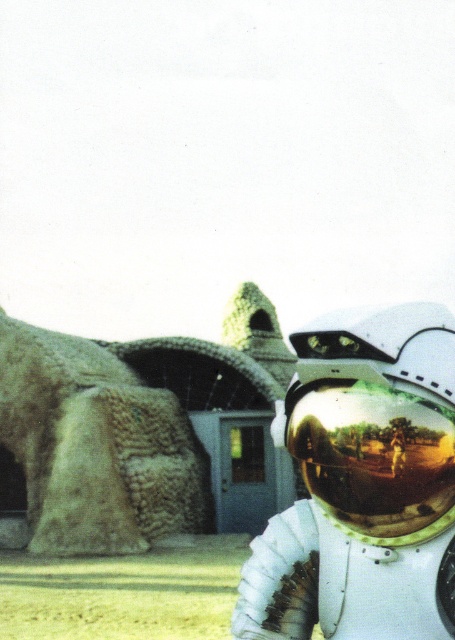
Measure the distance between shiny gold helmet at center and gold reflective helmet at center.

shiny gold helmet at center and gold reflective helmet at center are 3.78 inches apart from each other.

Is shiny gold helmet at center shorter than gold reflective helmet at center?

No, shiny gold helmet at center is not shorter than gold reflective helmet at center.

Describe the element at coordinates (362, 483) in the screenshot. The height and width of the screenshot is (640, 455). I see `shiny gold helmet at center` at that location.

In order to click on shiny gold helmet at center in this screenshot , I will do `click(362, 483)`.

Which is more to the left, rustic stone sculpture at left or gold reflective helmet at center?

Positioned to the left is rustic stone sculpture at left.

Is rustic stone sculpture at left wider than gold reflective helmet at center?

Yes.

Find the location of `rustic stone sculpture at left`. rustic stone sculpture at left is located at coordinates (96, 445).

Where is `rustic stone sculpture at left`? rustic stone sculpture at left is located at coordinates (96, 445).

Between point (338, 508) and point (65, 419), which one is positioned behind?

Point (65, 419)

Does shiny gold helmet at center come in front of rustic stone sculpture at left?

Yes, shiny gold helmet at center is closer to the viewer.

What do you see at coordinates (362, 483) in the screenshot? I see `shiny gold helmet at center` at bounding box center [362, 483].

Where is `shiny gold helmet at center`? This screenshot has height=640, width=455. shiny gold helmet at center is located at coordinates (362, 483).